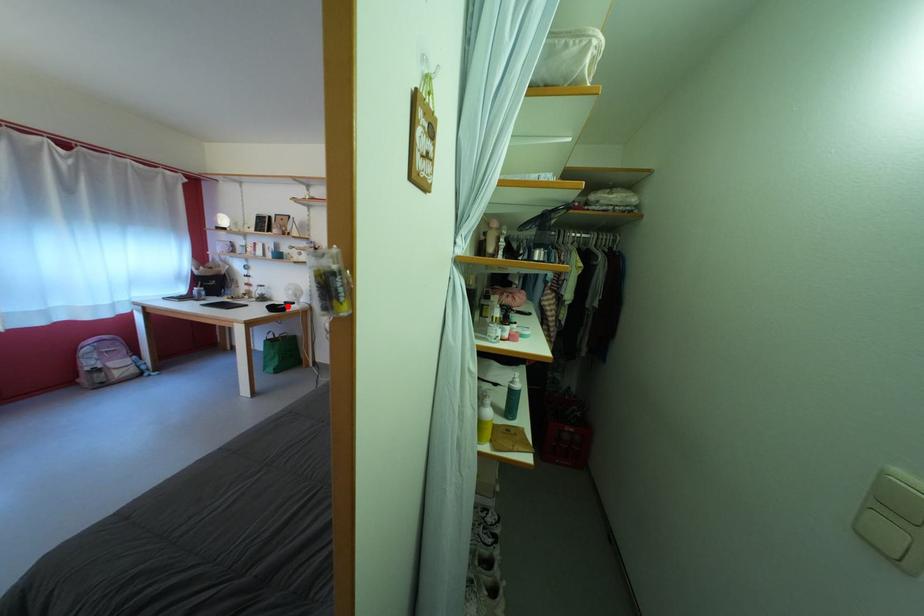
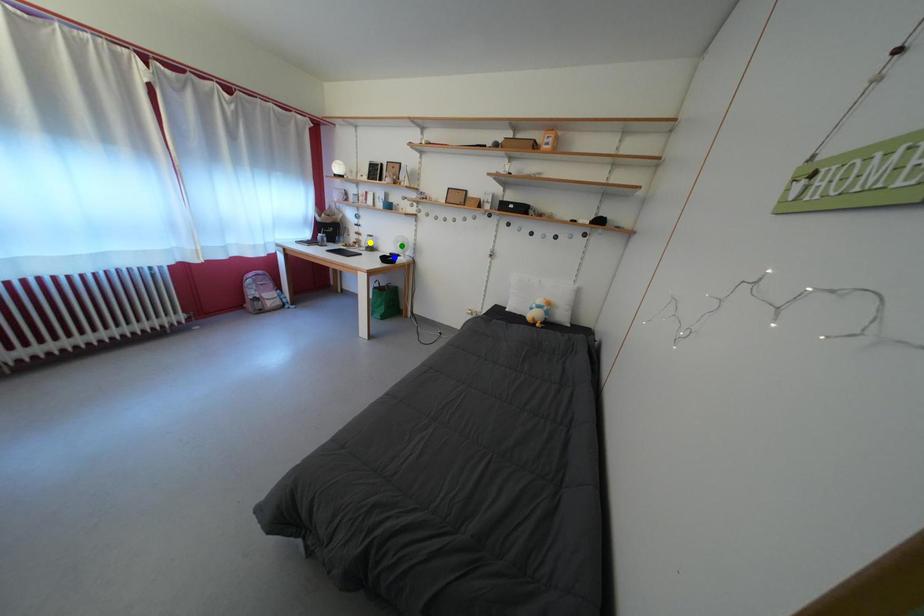
Question: I am providing you with two images of the same scene from different viewpoints. A red point is marked on the first image. You are given multiple points on the second image. Which point in image 2 represents the same 3d spot as the red point in image 1?

Choices:
 (A) green point
 (B) yellow point
 (C) blue point

Answer: (C)